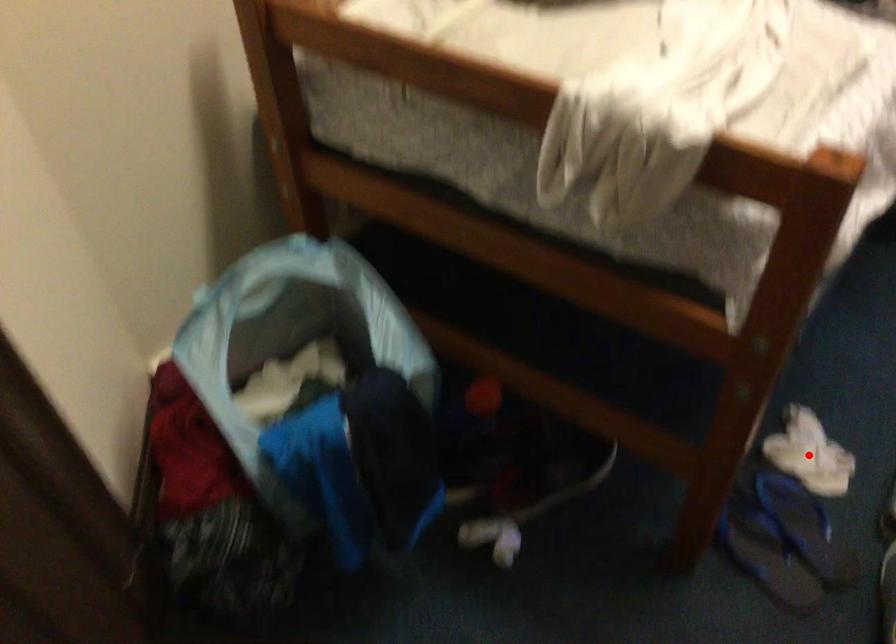
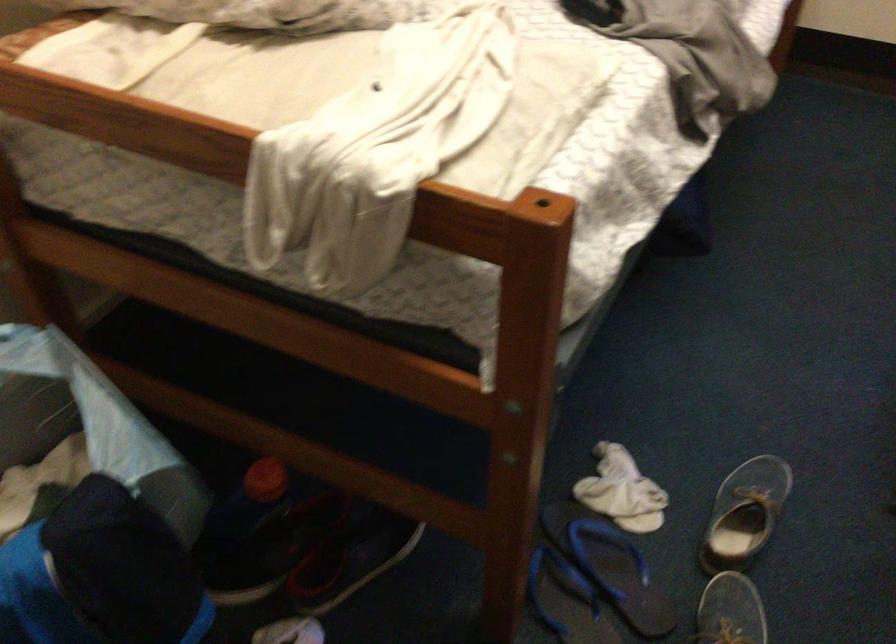
Find the pixel in the second image that matches the highlighted location in the first image.

(622, 491)